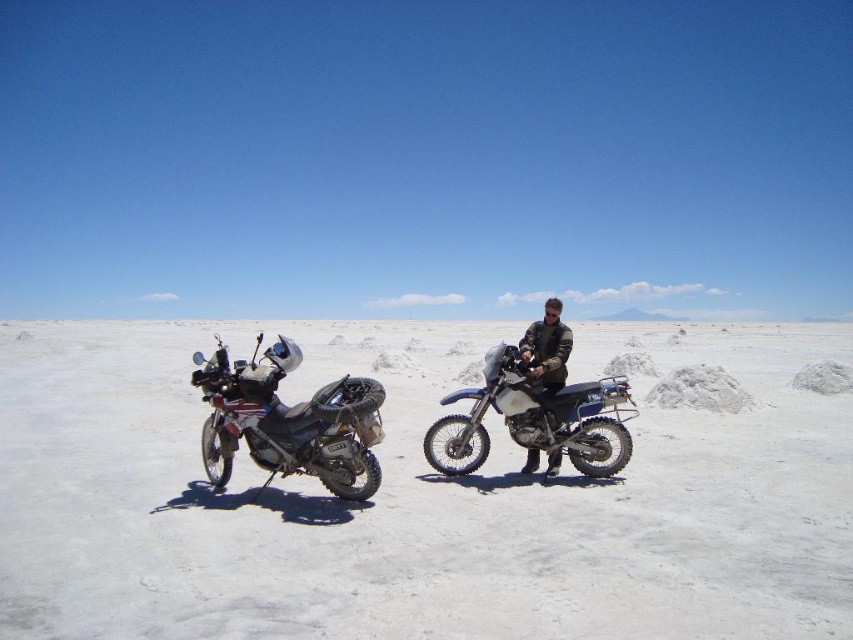
Is white matte dirt bike at center below matte black motorcycle at center?

Actually, white matte dirt bike at center is above matte black motorcycle at center.

Who is higher up, white matte dirt bike at center or matte black motorcycle at center?

white matte dirt bike at center is above.

Is point (51, 426) behind point (573, 401)?

Yes, it is behind point (573, 401).

What are the coordinates of `white matte dirt bike at center` in the screenshot? It's located at (416, 499).

Which is below, matte black motorcycle at left or matte black motorcycle at center?

matte black motorcycle at center is below.

Can you confirm if matte black motorcycle at left is wider than matte black motorcycle at center?

Correct, the width of matte black motorcycle at left exceeds that of matte black motorcycle at center.

Is point (268, 376) less distant than point (437, 428)?

Yes, point (268, 376) is in front of point (437, 428).

You are a GUI agent. You are given a task and a screenshot of the screen. Output one action in this format:
    pyautogui.click(x=<x>, y=<y>)
    Task: Click on the matte black motorcycle at left
    
    Given the screenshot: What is the action you would take?
    pyautogui.click(x=288, y=420)

Does point (566, 420) come behind point (561, 337)?

No, it is not.

Does matte black motorcycle at center lie behind dark brown leather jacket at center?

Yes, matte black motorcycle at center is behind dark brown leather jacket at center.

Where is `matte black motorcycle at center`? Image resolution: width=853 pixels, height=640 pixels. matte black motorcycle at center is located at coordinates (534, 419).